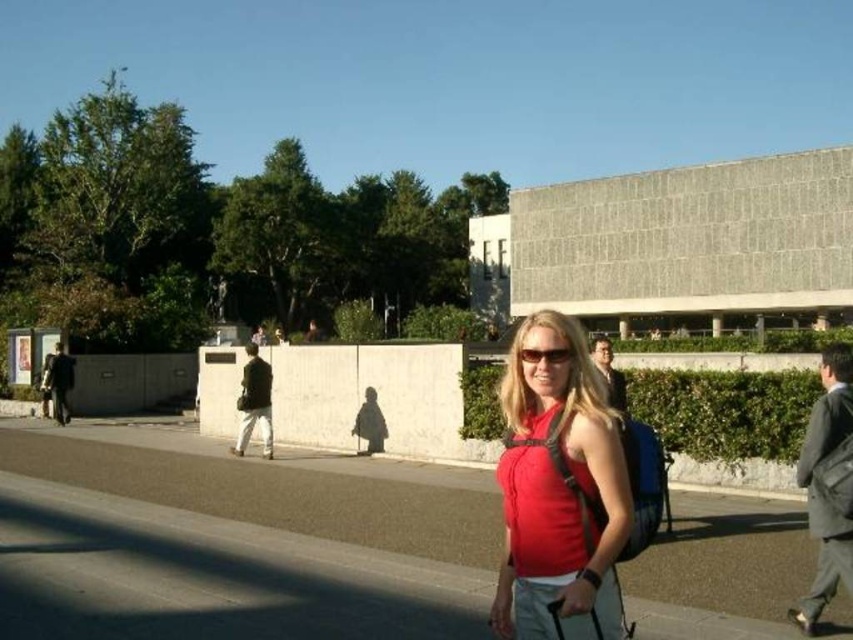
Question: Can you confirm if gray asphalt pavement at center is positioned to the right of matte black sunglasses at center?

Choices:
 (A) no
 (B) yes

Answer: (A)

Question: In this image, where is red matte tank top at center located relative to matte black sunglasses at center?

Choices:
 (A) left
 (B) right

Answer: (B)

Question: Which object is closer to the camera taking this photo?

Choices:
 (A) red matte tank top at center
 (B) matte black sunglasses at center

Answer: (A)

Question: Based on their relative distances, which object is farther from the gray asphalt pavement at center?

Choices:
 (A) red matte tank top at center
 (B) matte black sunglasses at center

Answer: (B)

Question: Which object appears closest to the camera in this image?

Choices:
 (A) matte black sunglasses at center
 (B) red matte tank top at center

Answer: (B)

Question: Is gray asphalt pavement at center bigger than red matte tank top at center?

Choices:
 (A) yes
 (B) no

Answer: (B)